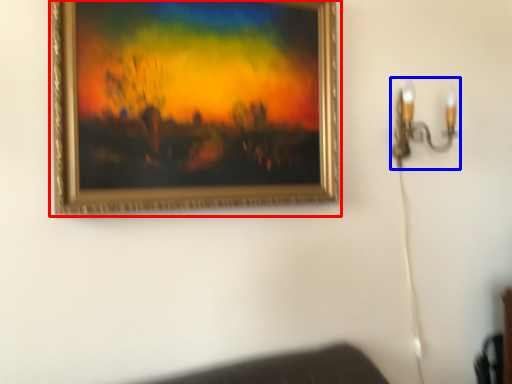
Question: Which of the following is the farthest to the observer, picture frame (highlighted by a red box) or lamp (highlighted by a blue box)?

Choices:
 (A) picture frame
 (B) lamp

Answer: (B)